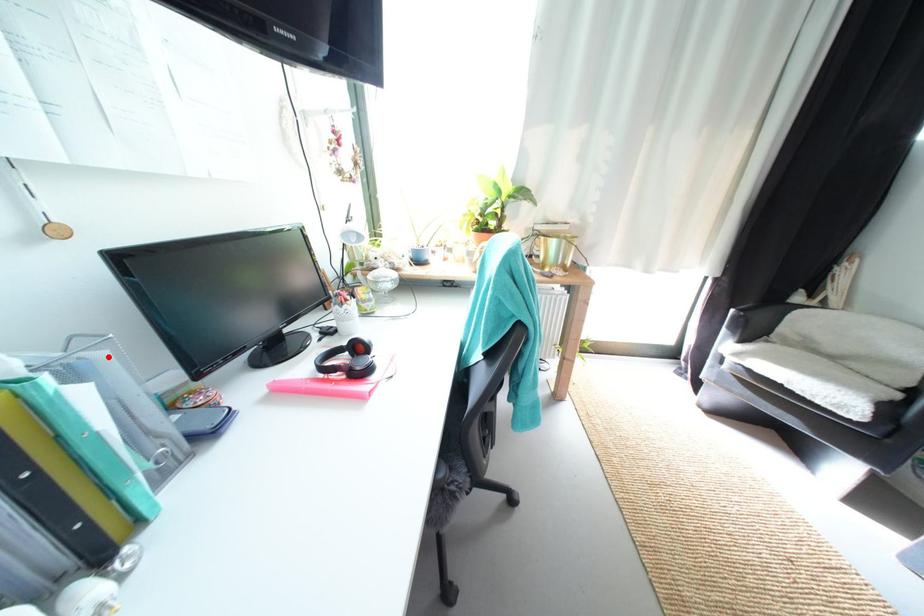
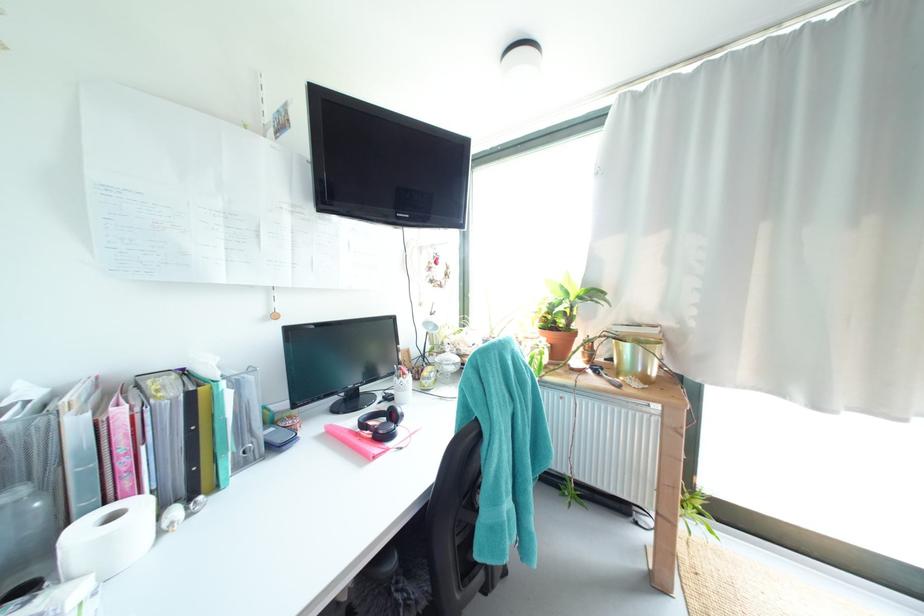
The point at the highlighted location is marked in the first image. Where is the corresponding point in the second image?

(259, 379)